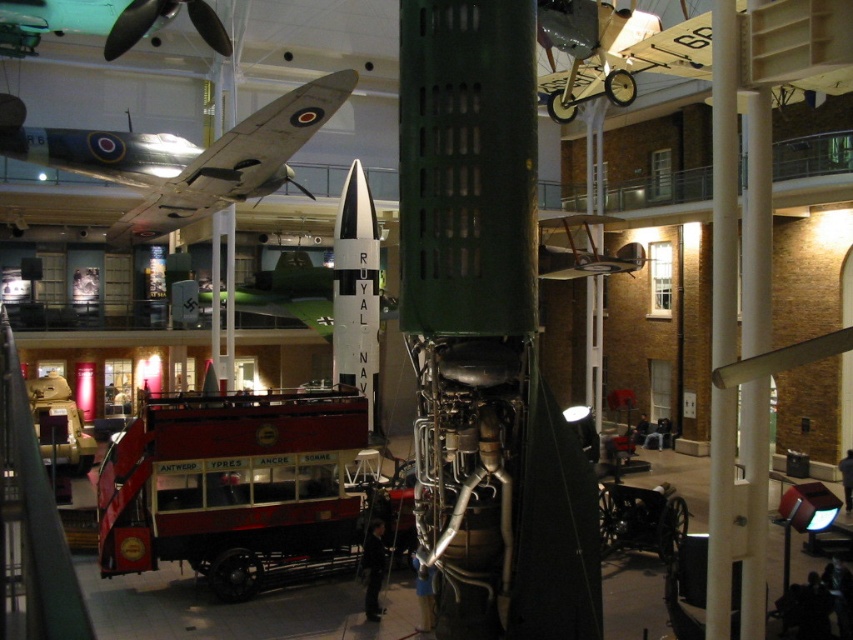
Question: Does white matte royal navy missile at center have a lesser width compared to brushed metal airplane at upper left?

Choices:
 (A) yes
 (B) no

Answer: (A)

Question: Which point is closer to the camera?

Choices:
 (A) (39, 12)
 (B) (314, 100)

Answer: (B)

Question: Which point appears farthest from the camera in this image?

Choices:
 (A) (318, 90)
 (B) (51, 29)
 (C) (245, 483)
 (D) (349, 269)

Answer: (D)

Question: Which of the following is the closest to the observer?

Choices:
 (A) light beige wood airplane at upper center
 (B) white matte royal navy missile at center
 (C) polished silver airplane at upper left

Answer: (A)

Question: In this image, where is polished silver airplane at upper left located relative to white matte royal navy missile at center?

Choices:
 (A) below
 (B) above

Answer: (B)

Question: Is red polished wood decker bus at center thinner than light beige wood airplane at upper center?

Choices:
 (A) yes
 (B) no

Answer: (A)